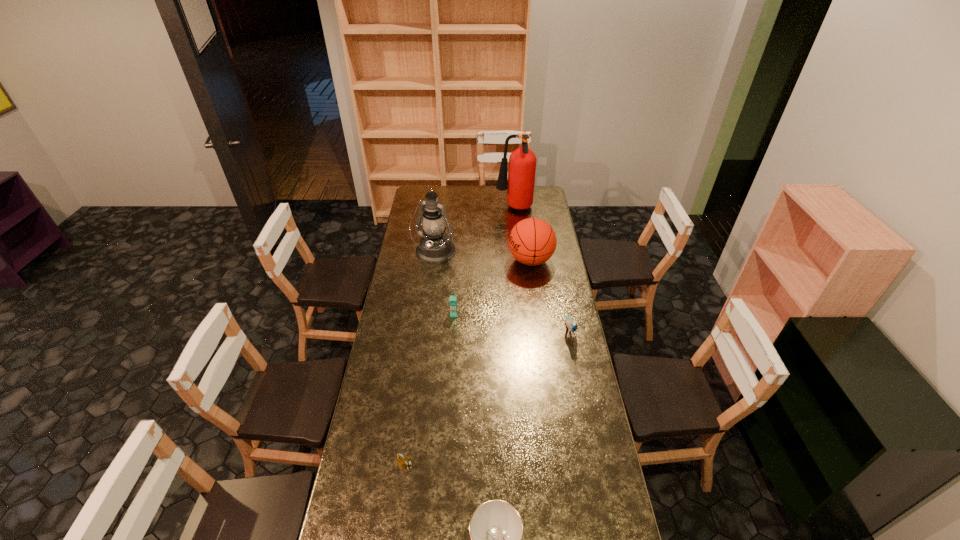
Find the location of a particular element. This screenshot has height=540, width=960. fire extinguisher that is at the right edge is located at coordinates (522, 162).

Locate an element on the screen. This screenshot has height=540, width=960. basketball that is at the right edge is located at coordinates (532, 241).

Where is `bird located in the right edge section of the desktop`? The image size is (960, 540). bird located in the right edge section of the desktop is located at coordinates coord(572,324).

The image size is (960, 540). Identify the location of object at the far right corner. (522, 162).

Locate an element on the screen. The width and height of the screenshot is (960, 540). vacant space at the far edge is located at coordinates (495, 201).

Identify the location of vacant space at the left edge of the desktop. (358, 433).

In order to click on free region at the right edge in this screenshot , I will do `click(551, 300)`.

This screenshot has height=540, width=960. I want to click on free area in between the bird and the fire extinguisher, so click(x=541, y=270).

Find the location of a particular element. free point between the fire extinguisher and the cellular telephone is located at coordinates [484, 261].

The image size is (960, 540). I want to click on empty space between the padlock and the third tallest object, so click(x=468, y=363).